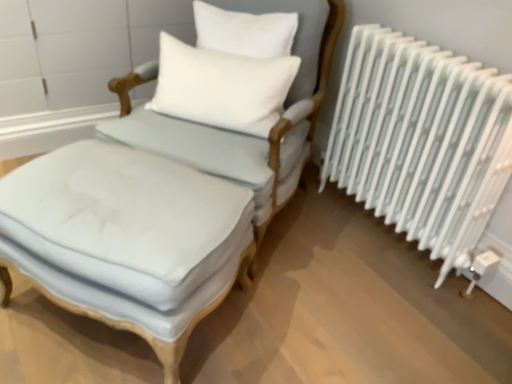
Question: Is light blue fabric chair at center aimed at light blue fabric ottoman at center?

Choices:
 (A) yes
 (B) no

Answer: (B)

Question: Is light blue fabric chair at center completely or partially outside of light blue fabric ottoman at center?

Choices:
 (A) no
 (B) yes

Answer: (B)

Question: Can you confirm if light blue fabric chair at center is positioned to the right of light blue fabric ottoman at center?

Choices:
 (A) no
 (B) yes

Answer: (B)

Question: Does light blue fabric chair at center have a lesser height compared to light blue fabric ottoman at center?

Choices:
 (A) yes
 (B) no

Answer: (A)

Question: Considering the relative sizes of light blue fabric chair at center and light blue fabric ottoman at center in the image provided, is light blue fabric chair at center thinner than light blue fabric ottoman at center?

Choices:
 (A) yes
 (B) no

Answer: (B)

Question: Considering the relative sizes of light blue fabric chair at center and light blue fabric ottoman at center in the image provided, is light blue fabric chair at center wider than light blue fabric ottoman at center?

Choices:
 (A) no
 (B) yes

Answer: (B)

Question: From the image's perspective, would you say white soft cushion at upper center is positioned over white metal radiator at right?

Choices:
 (A) yes
 (B) no

Answer: (A)

Question: Can you confirm if white soft cushion at upper center is thinner than white metal radiator at right?

Choices:
 (A) yes
 (B) no

Answer: (A)

Question: Is white soft cushion at upper center shorter than white metal radiator at right?

Choices:
 (A) no
 (B) yes

Answer: (B)

Question: From the image's perspective, does white soft cushion at upper center appear lower than white metal radiator at right?

Choices:
 (A) yes
 (B) no

Answer: (B)

Question: Is white soft cushion at upper center outside of white metal radiator at right?

Choices:
 (A) yes
 (B) no

Answer: (A)

Question: Is white soft cushion at upper center to the right of white metal radiator at right from the viewer's perspective?

Choices:
 (A) no
 (B) yes

Answer: (A)

Question: Is white metal radiator at right facing away from light blue fabric chair at center?

Choices:
 (A) yes
 (B) no

Answer: (B)